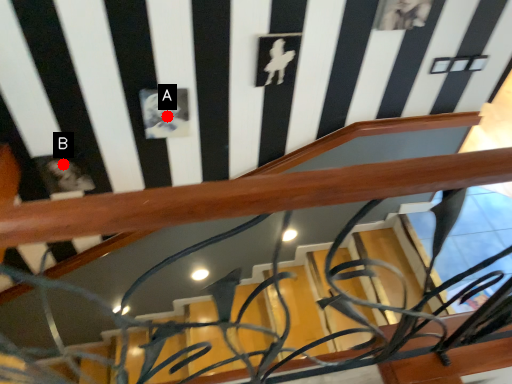
Question: Two points are circled on the image, labeled by A and B beside each circle. Among these points, which one is farthest from the camera?

Choices:
 (A) A is further
 (B) B is further

Answer: (B)